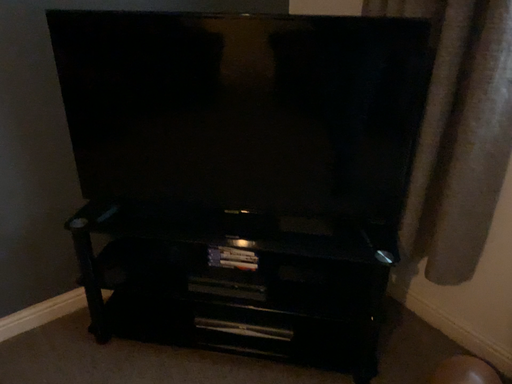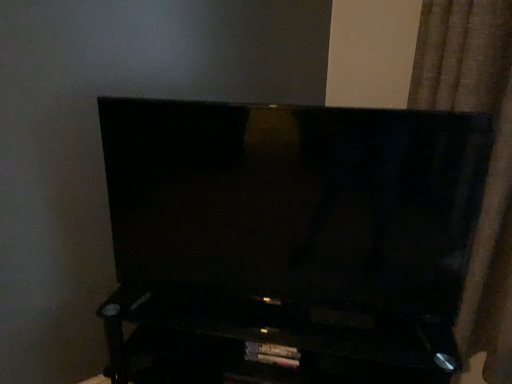
Question: How did the camera likely rotate when shooting the video?

Choices:
 (A) rotated downward
 (B) rotated upward

Answer: (B)